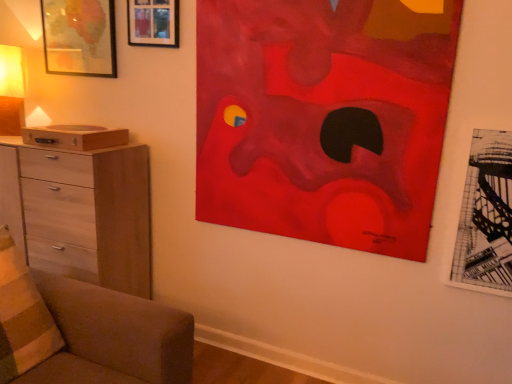
Question: Are black paper picture frame at right, arranged as the third picture frame when viewed from the back, and matte yellow fabric at left located far from each other?

Choices:
 (A) yes
 (B) no

Answer: (A)

Question: From the image's perspective, is black paper picture frame at right, which appears as the first picture frame when viewed from the right, on matte yellow fabric at left?

Choices:
 (A) yes
 (B) no

Answer: (B)

Question: Is black paper picture frame at right, the third picture frame when ordered from left to right, wider than matte yellow fabric at left?

Choices:
 (A) yes
 (B) no

Answer: (B)

Question: Considering the relative positions of black paper picture frame at right, the first picture frame in the front-to-back sequence, and matte yellow fabric at left in the image provided, is black paper picture frame at right, the first picture frame in the front-to-back sequence, to the left of matte yellow fabric at left from the viewer's perspective?

Choices:
 (A) no
 (B) yes

Answer: (A)

Question: Is black paper picture frame at right, arranged as the 1th picture frame when ordered from the bottom, outside of matte yellow fabric at left?

Choices:
 (A) no
 (B) yes

Answer: (B)

Question: Does black paper picture frame at right, the first picture frame in the front-to-back sequence, turn towards matte yellow fabric at left?

Choices:
 (A) no
 (B) yes

Answer: (A)

Question: Is matte wooden picture frame at upper left, which is the second picture frame from top to bottom, at the right side of striped fabric pillow at lower left?

Choices:
 (A) yes
 (B) no

Answer: (B)

Question: Is matte wooden picture frame at upper left, which is the second picture frame from top to bottom, facing towards striped fabric pillow at lower left?

Choices:
 (A) yes
 (B) no

Answer: (B)

Question: Is matte wooden picture frame at upper left, which is the second picture frame from top to bottom, closer to camera compared to striped fabric pillow at lower left?

Choices:
 (A) yes
 (B) no

Answer: (B)

Question: From the image's perspective, is matte wooden picture frame at upper left, which is the 1th picture frame in left-to-right order, over striped fabric pillow at lower left?

Choices:
 (A) no
 (B) yes

Answer: (B)

Question: Considering the relative sizes of matte wooden picture frame at upper left, positioned as the 2th picture frame in bottom-to-top order, and striped fabric pillow at lower left in the image provided, is matte wooden picture frame at upper left, positioned as the 2th picture frame in bottom-to-top order, shorter than striped fabric pillow at lower left?

Choices:
 (A) yes
 (B) no

Answer: (A)

Question: Can you confirm if matte wooden picture frame at upper left, which is counted as the first picture frame, starting from the back, is smaller than striped fabric pillow at lower left?

Choices:
 (A) no
 (B) yes

Answer: (B)

Question: Does matte red abstract painting at upper right turn towards wooden picture frame at upper left, placed as the 2th picture frame when sorted from front to back?

Choices:
 (A) no
 (B) yes

Answer: (A)